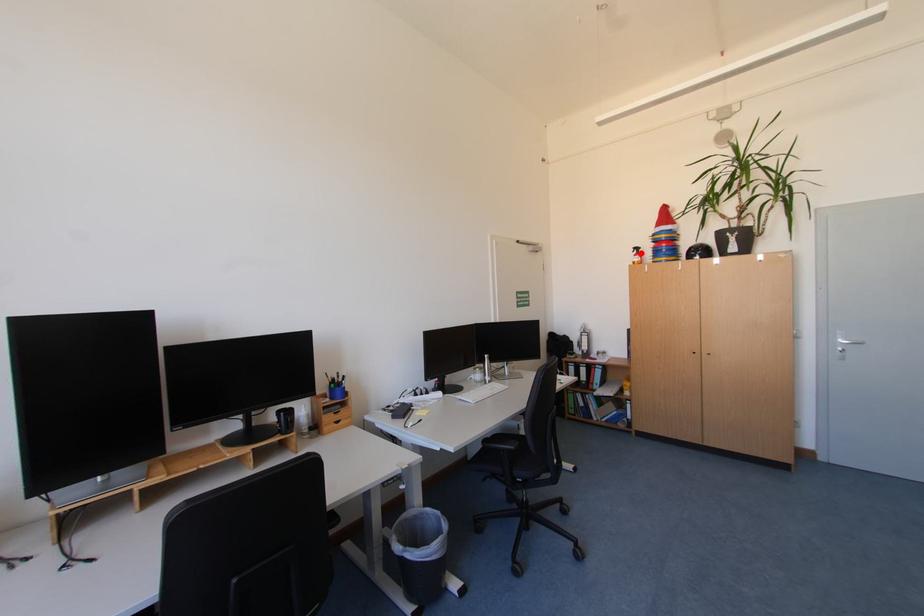
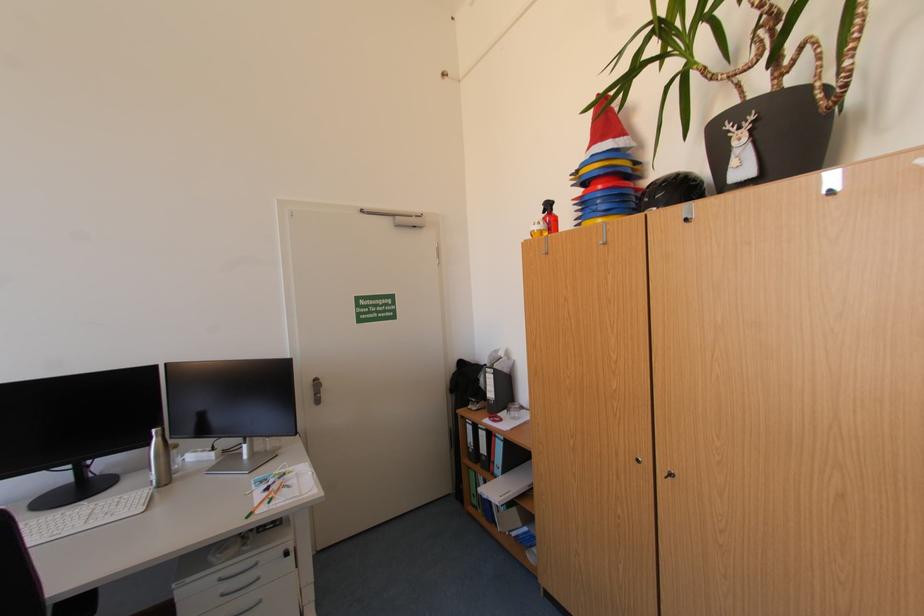
Question: I am providing you with two images of the same scene from different viewpoints. A red point is marked on the first image. Is the red point's position out of view in image 2?

Choices:
 (A) Yes
 (B) No

Answer: (B)